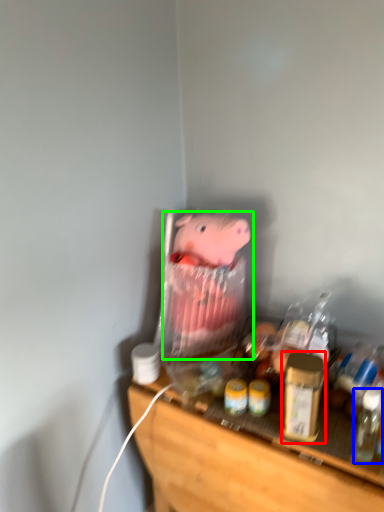
Question: Estimate the real-world distances between objects in this image. Which object is farther from beverage (highlighted by a red box), bottle (highlighted by a blue box) or toy (highlighted by a green box)?

Choices:
 (A) bottle
 (B) toy

Answer: (B)